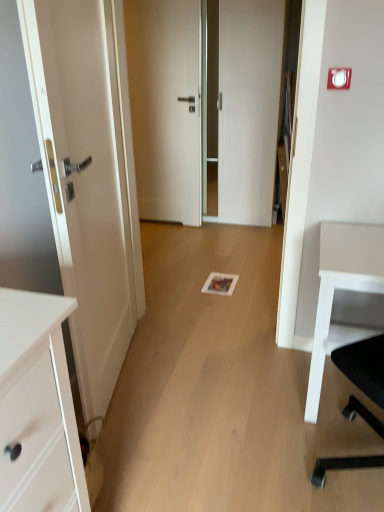
Locate an element on the screen. This screenshot has width=384, height=512. free space to the left of white matte desk at right is located at coordinates (255, 396).